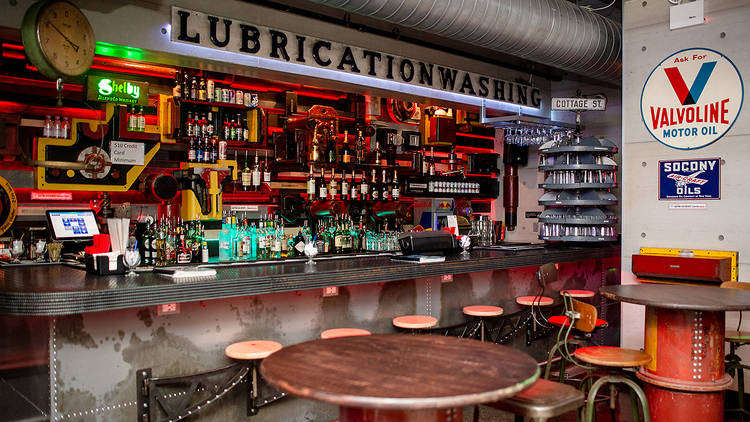
Find the location of `white napkins in a napkin holder`. white napkins in a napkin holder is located at coordinates (111, 256).